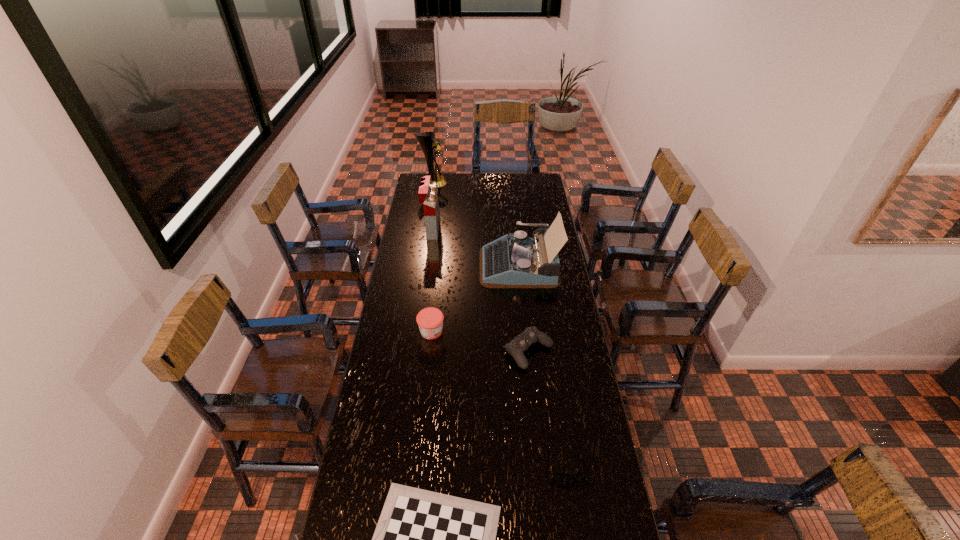
The width and height of the screenshot is (960, 540). I want to click on typewriter that is at the right edge, so click(514, 260).

Where is `control present at the right edge`? This screenshot has height=540, width=960. control present at the right edge is located at coordinates (530, 335).

Locate an element on the screen. This screenshot has width=960, height=540. sunglasses at the right edge is located at coordinates (557, 476).

The height and width of the screenshot is (540, 960). In order to click on object that is at the far left corner in this screenshot , I will do `click(428, 144)`.

Locate an element on the screen. This screenshot has height=540, width=960. vacant space at the far edge of the desktop is located at coordinates (447, 187).

Image resolution: width=960 pixels, height=540 pixels. In order to click on free space at the left edge of the desktop in this screenshot , I will do `click(411, 219)`.

At what (x,y) coordinates should I click in order to perform the action: click on vacant space at the right edge. Please return your answer as a coordinate pair (x, y). This screenshot has height=540, width=960. Looking at the image, I should click on (565, 314).

Locate an element on the screen. This screenshot has width=960, height=540. free spot between the second shortest object and the cigarette case is located at coordinates 500,347.

Identify the location of vacant point located between the jam and the sixth nearest object. The width and height of the screenshot is (960, 540). (431, 281).

Locate which object is the fourth closest to the fourth shortest object. Please provide its 2D coordinates. Your answer should be formatted as a tuple, i.e. [(x, y)], where the tuple contains the x and y coordinates of a point satisfying the conditions above.

[(557, 476)]